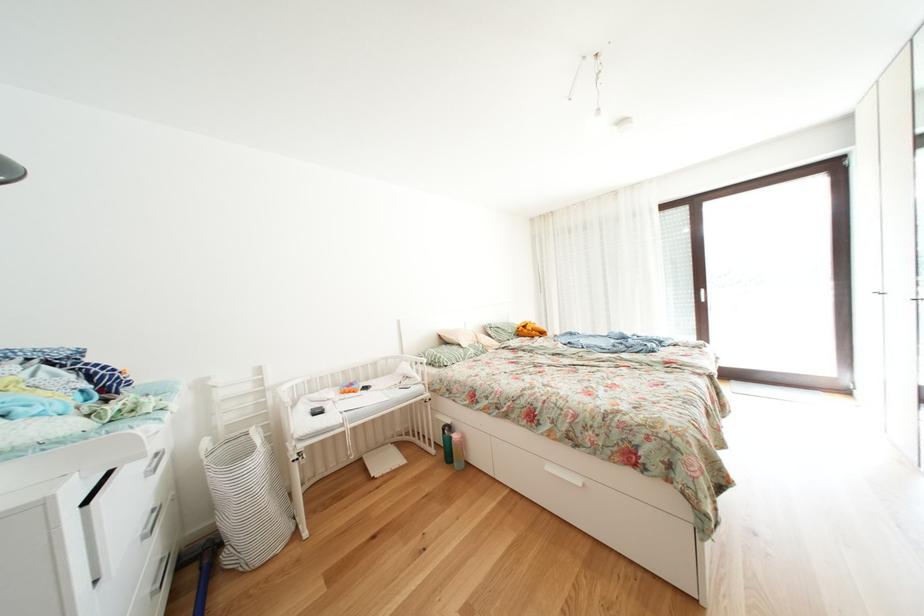
What do you see at coordinates (564, 474) in the screenshot? I see `the white bed drawer handle` at bounding box center [564, 474].